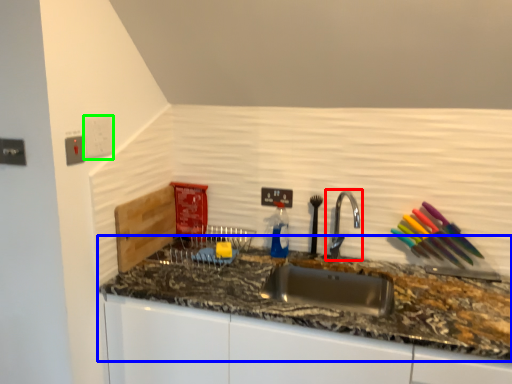
Question: Based on their relative distances, which object is farther from tap (highlighted by a red box)? Choose from countertop (highlighted by a blue box) and electric outlet (highlighted by a green box).

Choices:
 (A) countertop
 (B) electric outlet

Answer: (B)